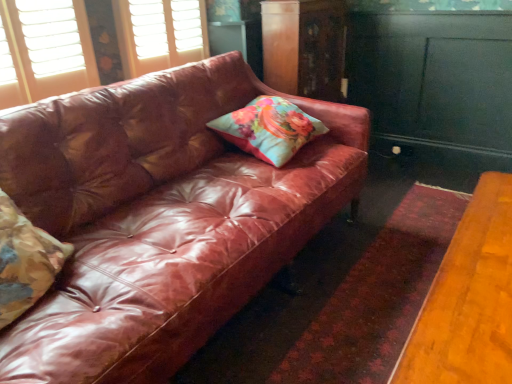
Describe the element at coordinates (304, 47) in the screenshot. Image resolution: width=512 pixels, height=384 pixels. I see `wooden dresser at upper center, placed as the second dresser when sorted from right to left` at that location.

This screenshot has width=512, height=384. Describe the element at coordinates (25, 261) in the screenshot. I see `floral fabric pillow at left, acting as the first pillow starting from the left` at that location.

What do you see at coordinates (269, 129) in the screenshot?
I see `floral fabric cushion at center, acting as the 1th pillow starting from the back` at bounding box center [269, 129].

Where is `wooden dresser at upper center, placed as the second dresser when sorted from right to left`? wooden dresser at upper center, placed as the second dresser when sorted from right to left is located at coordinates (x=304, y=47).

I want to click on the 1st dresser counting from the right side of the floral fabric cushion at center, placed as the first pillow when sorted from top to bottom, so click(304, 47).

Is wooden dresser at upper center, marked as the first dresser in a left-to-right arrangement, further to camera compared to floral fabric cushion at center, placed as the 1th pillow when sorted from right to left?

Yes, wooden dresser at upper center, marked as the first dresser in a left-to-right arrangement, is further from the camera.

Looking at this image, from the image's perspective, is wooden dresser at upper center, placed as the second dresser when sorted from right to left, above floral fabric cushion at center, which is counted as the 2th pillow, starting from the left?

Yes, from the image's perspective, wooden dresser at upper center, placed as the second dresser when sorted from right to left, is above floral fabric cushion at center, which is counted as the 2th pillow, starting from the left.

Looking at this image, is wooden dresser at upper center, placed as the second dresser when sorted from right to left, facing away from floral fabric cushion at center, placed as the first pillow when sorted from top to bottom?

That's not correct — wooden dresser at upper center, placed as the second dresser when sorted from right to left, is not looking away from floral fabric cushion at center, placed as the first pillow when sorted from top to bottom.

Is teal painted wood dresser at right, which is counted as the second dresser, starting from the left, next to shiny brown leather couch at center and touching it?

No, teal painted wood dresser at right, which is counted as the second dresser, starting from the left, is not in contact with shiny brown leather couch at center.

Could you tell me if teal painted wood dresser at right, which is counted as the 1th dresser, starting from the right, is facing shiny brown leather couch at center?

Yes.

From the image's perspective, is teal painted wood dresser at right, which is counted as the 1th dresser, starting from the right, above or below shiny brown leather couch at center?

teal painted wood dresser at right, which is counted as the 1th dresser, starting from the right, is above shiny brown leather couch at center.

Is point (371, 86) more distant than point (153, 257)?

Yes, it is.

Could you tell me if floral fabric pillow at left, acting as the first pillow starting from the left, is facing floral fabric cushion at center, acting as the 1th pillow starting from the back?

No, floral fabric pillow at left, acting as the first pillow starting from the left, does not turn towards floral fabric cushion at center, acting as the 1th pillow starting from the back.

How much distance is there between floral fabric pillow at left, which ranks as the 1th pillow in front-to-back order, and floral fabric cushion at center, acting as the 1th pillow starting from the back?

1.04 meters.

Between floral fabric pillow at left, which ranks as the second pillow in back-to-front order, and floral fabric cushion at center, acting as the 1th pillow starting from the back, which one has smaller width?

floral fabric pillow at left, which ranks as the second pillow in back-to-front order, is thinner.

Visually, is floral fabric pillow at left, acting as the first pillow starting from the left, positioned to the left or to the right of floral fabric cushion at center, arranged as the 2th pillow when viewed from the front?

In the image, floral fabric pillow at left, acting as the first pillow starting from the left, appears on the left side of floral fabric cushion at center, arranged as the 2th pillow when viewed from the front.

From the image's perspective, between shiny brown leather couch at center and wooden dresser at upper center, placed as the second dresser when sorted from right to left, who is located below?

shiny brown leather couch at center appears lower in the image.

Is shiny brown leather couch at center facing away from wooden dresser at upper center, placed as the second dresser when sorted from right to left?

No, wooden dresser at upper center, placed as the second dresser when sorted from right to left, is not at the back of shiny brown leather couch at center.

Considering the sizes of shiny brown leather couch at center and wooden dresser at upper center, placed as the second dresser when sorted from right to left, in the image, is shiny brown leather couch at center wider or thinner than wooden dresser at upper center, placed as the second dresser when sorted from right to left,?

Considering their sizes, shiny brown leather couch at center looks broader than wooden dresser at upper center, placed as the second dresser when sorted from right to left.

Is shiny brown leather couch at center next to wooden dresser at upper center, placed as the second dresser when sorted from right to left, and touching it?

No, shiny brown leather couch at center is not in contact with wooden dresser at upper center, placed as the second dresser when sorted from right to left.

Considering the sizes of teal painted wood dresser at right, which is counted as the second dresser, starting from the left, and floral fabric cushion at center, placed as the 1th pillow when sorted from right to left, in the image, is teal painted wood dresser at right, which is counted as the second dresser, starting from the left, bigger or smaller than floral fabric cushion at center, placed as the 1th pillow when sorted from right to left,?

Considering their sizes, teal painted wood dresser at right, which is counted as the second dresser, starting from the left, takes up more space than floral fabric cushion at center, placed as the 1th pillow when sorted from right to left.

Does teal painted wood dresser at right, which is counted as the 1th dresser, starting from the right, have a greater height compared to floral fabric cushion at center, placed as the 1th pillow when sorted from right to left?

Indeed, teal painted wood dresser at right, which is counted as the 1th dresser, starting from the right, has a greater height compared to floral fabric cushion at center, placed as the 1th pillow when sorted from right to left.

Considering the points (476, 128) and (236, 134), which point is behind, point (476, 128) or point (236, 134)?

Point (476, 128)

From the image's perspective, which one is positioned higher, shiny brown leather couch at center or floral fabric pillow at left, acting as the 2th pillow starting from the right?

shiny brown leather couch at center.

Could you tell me if shiny brown leather couch at center is facing floral fabric pillow at left, the 2th pillow positioned from the top?

No, shiny brown leather couch at center is not oriented towards floral fabric pillow at left, the 2th pillow positioned from the top.

Which object is positioned more to the left, shiny brown leather couch at center or floral fabric pillow at left, which ranks as the 1th pillow in front-to-back order?

From the viewer's perspective, floral fabric pillow at left, which ranks as the 1th pillow in front-to-back order, appears more on the left side.

Does point (62, 102) lie in front of point (16, 279)?

No, it is behind (16, 279).

In the image, is wooden dresser at upper center, marked as the first dresser in a left-to-right arrangement, positioned in front of or behind floral fabric pillow at left, acting as the 2th pillow starting from the right?

wooden dresser at upper center, marked as the first dresser in a left-to-right arrangement, is behind floral fabric pillow at left, acting as the 2th pillow starting from the right.

Which is nearer, (x=337, y=40) or (x=8, y=277)?

Clearly, point (x=337, y=40) is more distant from the camera than point (x=8, y=277).

Identify the location of dresser that is the 1st object to the right of the floral fabric pillow at left, which ranks as the 1th pillow in front-to-back order, starting at the anchor. (304, 47).

Choose the correct answer: Is wooden dresser at upper center, marked as the first dresser in a left-to-right arrangement, inside floral fabric pillow at left, the 2th pillow positioned from the top, or outside it?

wooden dresser at upper center, marked as the first dresser in a left-to-right arrangement, exists outside the volume of floral fabric pillow at left, the 2th pillow positioned from the top.

The width and height of the screenshot is (512, 384). Find the location of `pillow that is the 1st object to the left of the wooden dresser at upper center, marked as the first dresser in a left-to-right arrangement, starting at the anchor`. pillow that is the 1st object to the left of the wooden dresser at upper center, marked as the first dresser in a left-to-right arrangement, starting at the anchor is located at coordinates (269, 129).

From a real-world perspective, count 1st dressers upward from the shiny brown leather couch at center and point to it. Please provide its 2D coordinates.

[(436, 80)]

When comparing their distances from floral fabric pillow at left, which ranks as the 1th pillow in front-to-back order, does shiny brown leather couch at center or floral fabric cushion at center, placed as the 1th pillow when sorted from right to left, seem further?

floral fabric cushion at center, placed as the 1th pillow when sorted from right to left, lies further to floral fabric pillow at left, which ranks as the 1th pillow in front-to-back order, than the other object.

When comparing their distances from floral fabric cushion at center, arranged as the 2th pillow when viewed from the front, does wooden dresser at upper center, marked as the first dresser in a left-to-right arrangement, or shiny brown leather couch at center seem closer?

shiny brown leather couch at center is positioned closer to the anchor floral fabric cushion at center, arranged as the 2th pillow when viewed from the front.

Considering their positions, is wooden dresser at upper center, marked as the first dresser in a left-to-right arrangement, positioned closer to floral fabric pillow at left, arranged as the 1th pillow when ordered from the bottom, than shiny brown leather couch at center?

Based on the image, shiny brown leather couch at center appears to be nearer to floral fabric pillow at left, arranged as the 1th pillow when ordered from the bottom.

Based on their spatial positions, is floral fabric pillow at left, which ranks as the second pillow in back-to-front order, or wooden dresser at upper center, placed as the second dresser when sorted from right to left, further from teal painted wood dresser at right, which is counted as the 1th dresser, starting from the right?

The object further to teal painted wood dresser at right, which is counted as the 1th dresser, starting from the right, is floral fabric pillow at left, which ranks as the second pillow in back-to-front order.

Estimate the real-world distances between objects in this image. Which object is closer to teal painted wood dresser at right, which is counted as the second dresser, starting from the left, floral fabric pillow at left, acting as the 2th pillow starting from the right, or shiny brown leather couch at center?

shiny brown leather couch at center is closer to teal painted wood dresser at right, which is counted as the second dresser, starting from the left.

Based on their spatial positions, is teal painted wood dresser at right, which is counted as the 1th dresser, starting from the right, or floral fabric pillow at left, which ranks as the 1th pillow in front-to-back order, closer to wooden dresser at upper center, placed as the second dresser when sorted from right to left?

Among the two, teal painted wood dresser at right, which is counted as the 1th dresser, starting from the right, is located nearer to wooden dresser at upper center, placed as the second dresser when sorted from right to left.

Looking at the image, which one is located further to floral fabric pillow at left, the 2th pillow positioned from the top, teal painted wood dresser at right, which is counted as the 1th dresser, starting from the right, or wooden dresser at upper center, marked as the first dresser in a left-to-right arrangement?

Among the two, teal painted wood dresser at right, which is counted as the 1th dresser, starting from the right, is located further to floral fabric pillow at left, the 2th pillow positioned from the top.

Based on their spatial positions, is shiny brown leather couch at center or wooden dresser at upper center, marked as the first dresser in a left-to-right arrangement, closer to teal painted wood dresser at right, which is counted as the 1th dresser, starting from the right?

The object closer to teal painted wood dresser at right, which is counted as the 1th dresser, starting from the right, is wooden dresser at upper center, marked as the first dresser in a left-to-right arrangement.

This screenshot has width=512, height=384. In order to click on dresser between shiny brown leather couch at center and wooden dresser at upper center, placed as the second dresser when sorted from right to left, from front to back in this screenshot , I will do `click(436, 80)`.

Where is `dresser between floral fabric pillow at left, the 2th pillow positioned from the top, and teal painted wood dresser at right, which is counted as the second dresser, starting from the left, from left to right`? This screenshot has height=384, width=512. dresser between floral fabric pillow at left, the 2th pillow positioned from the top, and teal painted wood dresser at right, which is counted as the second dresser, starting from the left, from left to right is located at coordinates (304, 47).

Locate an element on the screen. dresser located between floral fabric cushion at center, acting as the 1th pillow starting from the back, and teal painted wood dresser at right, which is counted as the second dresser, starting from the left, in the left-right direction is located at coordinates (304, 47).

I want to click on pillow between floral fabric pillow at left, which ranks as the second pillow in back-to-front order, and teal painted wood dresser at right, which is counted as the 1th dresser, starting from the right, so click(269, 129).